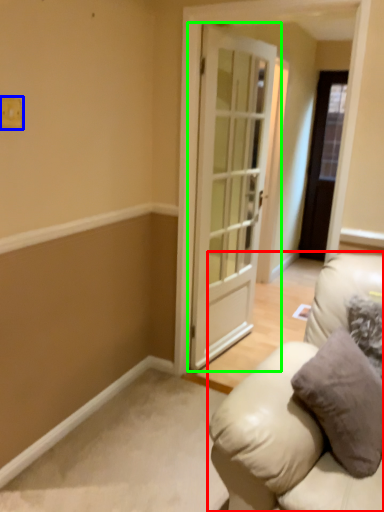
Question: Which object is positioned closest to studio couch (highlighted by a red box)? Select from light switch (highlighted by a blue box) and door (highlighted by a green box).

Choices:
 (A) light switch
 (B) door

Answer: (B)